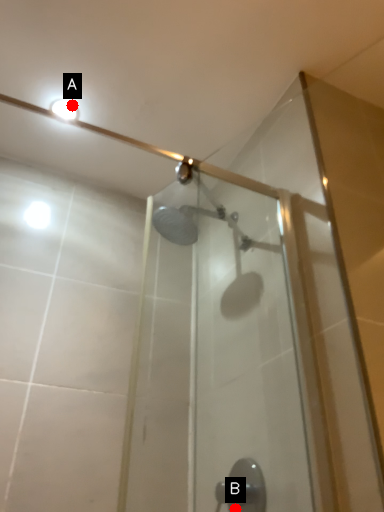
Question: Two points are circled on the image, labeled by A and B beside each circle. Among these points, which one is farthest from the camera?

Choices:
 (A) A is further
 (B) B is further

Answer: (A)